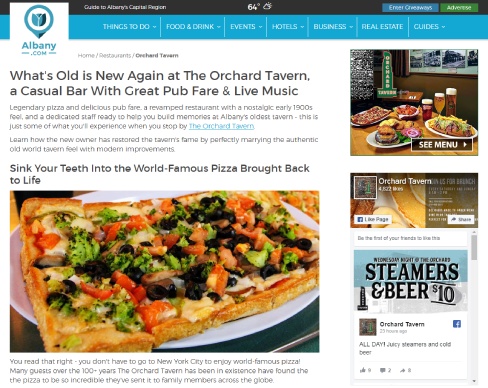
You are a GUI agent. You are given a task and a screenshot of the screen. Output one action in this format:
    pyautogui.click(x=<x>, y=<y>)
    Task: Click on the photographs on orchard tavern wall
    The image size is (488, 388).
    Given the screenshot: What is the action you would take?
    pyautogui.click(x=458, y=61), pyautogui.click(x=418, y=64)